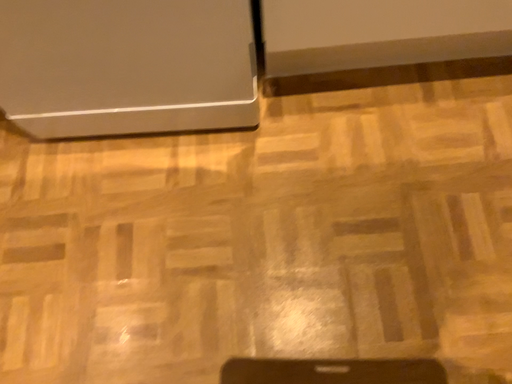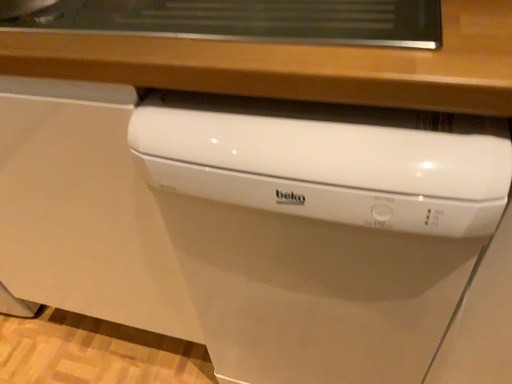
Question: Which way did the camera rotate in the video?

Choices:
 (A) rotated right
 (B) rotated left

Answer: (B)